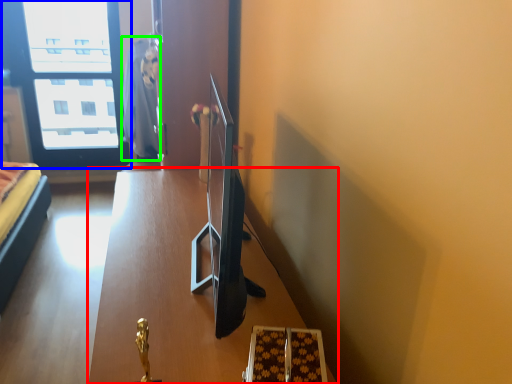
Question: Which object is the farthest from table (highlighted by a red box)? Choose among these: window (highlighted by a blue box) or robe (highlighted by a green box).

Choices:
 (A) window
 (B) robe

Answer: (A)